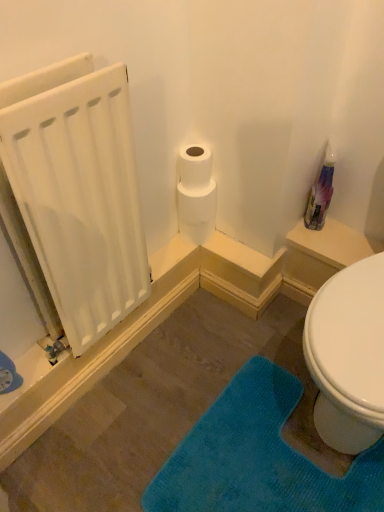
Image resolution: width=384 pixels, height=512 pixels. Identify the location of blank space to the left of teal plush bath mat at lower right. (114, 435).